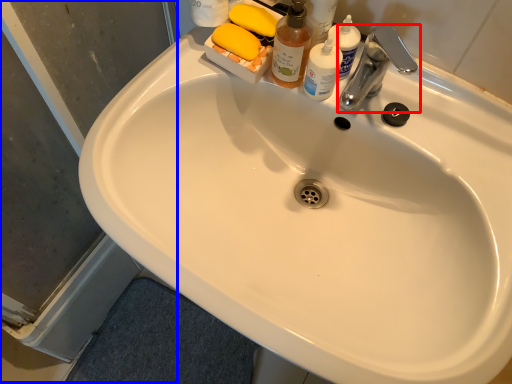
Question: Which of the following is the closest to the observer, tap (highlighted by a red box) or screen door (highlighted by a blue box)?

Choices:
 (A) tap
 (B) screen door

Answer: (B)